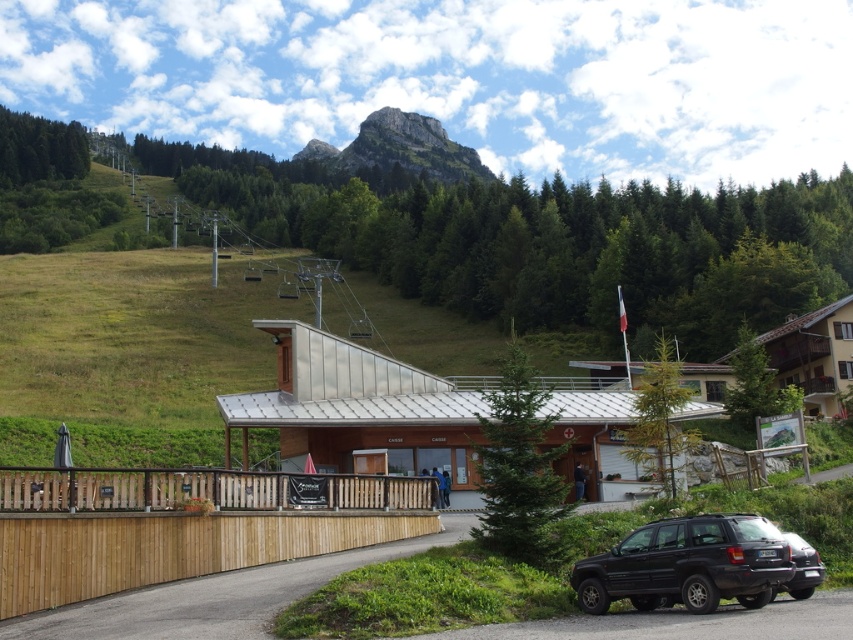
Question: Is brown wooden fence at lower center smaller than green rocky mountain at upper center?

Choices:
 (A) no
 (B) yes

Answer: (B)

Question: Which object appears closest to the camera in this image?

Choices:
 (A) wooden fence at lower center
 (B) green rocky mountain at upper center
 (C) brown wooden fence at lower center

Answer: (A)

Question: From the image, what is the correct spatial relationship of brown wooden fence at lower center in relation to green rocky mountain at upper center?

Choices:
 (A) left
 (B) right

Answer: (B)

Question: Which object appears farthest from the camera in this image?

Choices:
 (A) brown wooden fence at lower center
 (B) wooden fence at lower center

Answer: (A)

Question: Does wooden fence at lower center have a larger size compared to metallic silver ski lift at upper center?

Choices:
 (A) yes
 (B) no

Answer: (B)

Question: Estimate the real-world distances between objects in this image. Which object is farther from the green rocky mountain at upper center?

Choices:
 (A) wooden fence at lower center
 (B) metallic silver ski lift at upper center
 (C) brown wooden fence at lower center
 (D) black matte suv at lower right

Answer: (D)